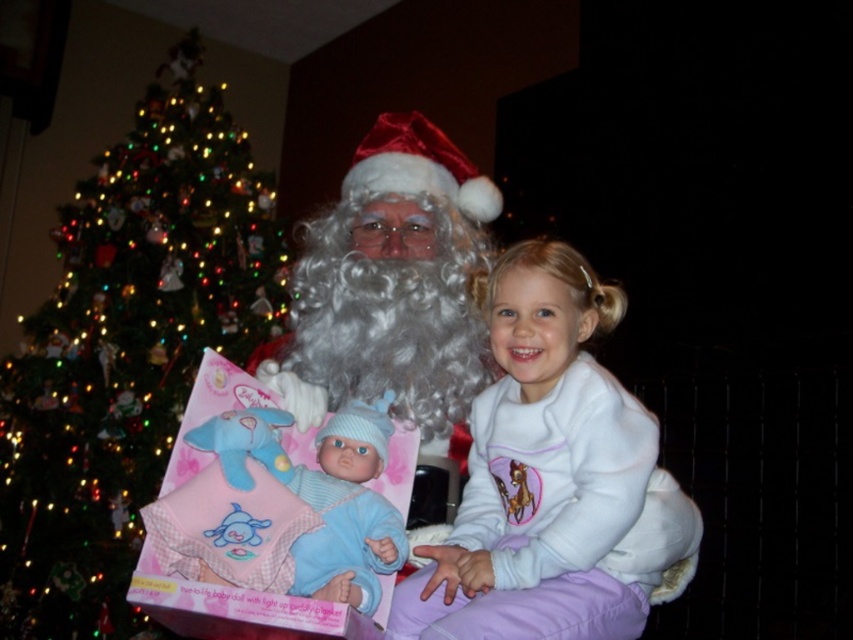
Can you confirm if green matte christmas tree at left is bigger than white fluffy santa at center?

Yes, green matte christmas tree at left is bigger than white fluffy santa at center.

Does point (15, 368) lie behind point (415, 417)?

Yes, point (15, 368) is behind point (415, 417).

Where is `green matte christmas tree at left`? The image size is (853, 640). green matte christmas tree at left is located at coordinates (126, 349).

Does green matte christmas tree at left appear on the left side of white fleece at center?

Yes, green matte christmas tree at left is to the left of white fleece at center.

Is green matte christmas tree at left bigger than white fleece at center?

Yes, green matte christmas tree at left is bigger than white fleece at center.

At what (x,y) coordinates should I click in order to perform the action: click on green matte christmas tree at left. Please return your answer as a coordinate pair (x, y). Looking at the image, I should click on (126, 349).

Does white fluffy santa at center have a greater height compared to blue plush baby doll at center?

Correct, white fluffy santa at center is much taller as blue plush baby doll at center.

Can you confirm if white fluffy santa at center is positioned below blue plush baby doll at center?

Actually, white fluffy santa at center is above blue plush baby doll at center.

This screenshot has width=853, height=640. What do you see at coordinates (392, 284) in the screenshot?
I see `white fluffy santa at center` at bounding box center [392, 284].

Where is `white fluffy santa at center`? white fluffy santa at center is located at coordinates (392, 284).